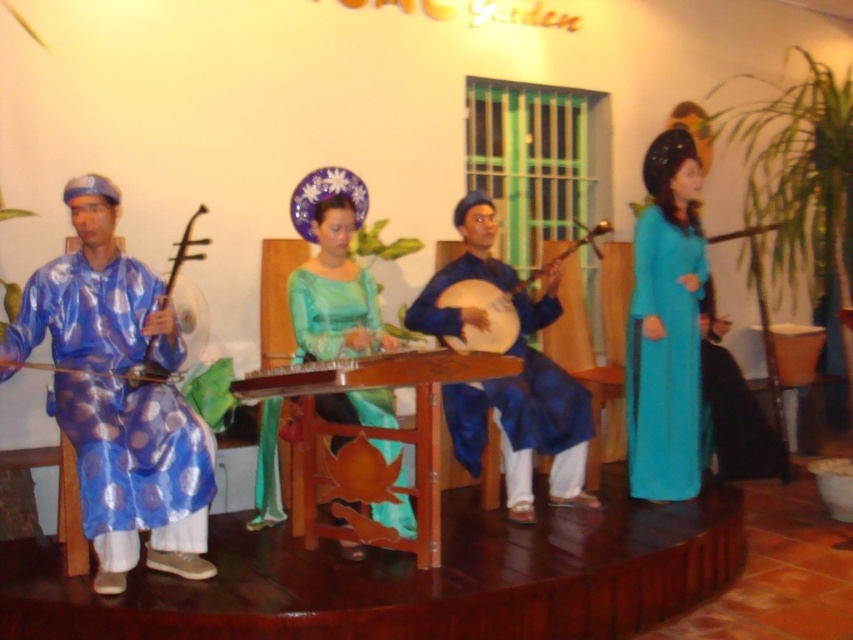
Question: Can you confirm if blue silk instrument at center is positioned below matte blue banjo at center?

Choices:
 (A) yes
 (B) no

Answer: (A)

Question: Which object is positioned closest to the wooden stringed instrument at center?

Choices:
 (A) blue silk instrument at center
 (B) matte blue wooden instrument at left
 (C) matte blue banjo at center

Answer: (B)

Question: Which object is the farthest from the wooden stringed instrument at center?

Choices:
 (A) blue shiny robe at left
 (B) green satin dress at center
 (C) blue silk instrument at center
 (D) matte black lute at left

Answer: (C)

Question: Observing the image, what is the correct spatial positioning of blue silk instrument at center in reference to green satin dress at center?

Choices:
 (A) right
 (B) left

Answer: (A)

Question: Which object is the closest to the green satin dress at center?

Choices:
 (A) blue shiny robe at left
 (B) matte blue banjo at center
 (C) matte blue wooden instrument at left
 (D) matte black lute at left

Answer: (B)

Question: Is teal silk ao dai at right below green satin dress at center?

Choices:
 (A) no
 (B) yes

Answer: (A)